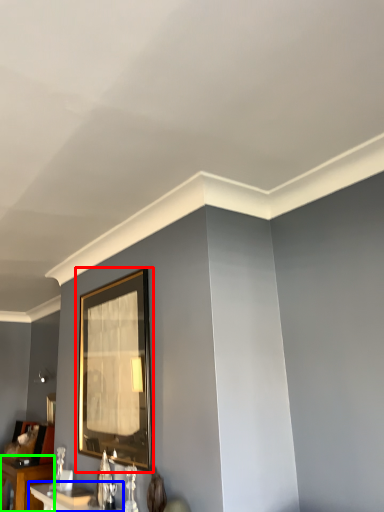
Question: Which object is the closest to the picture frame (highlighted by a red box)? Choose among these: table (highlighted by a blue box) or table (highlighted by a green box).

Choices:
 (A) table
 (B) table

Answer: (A)